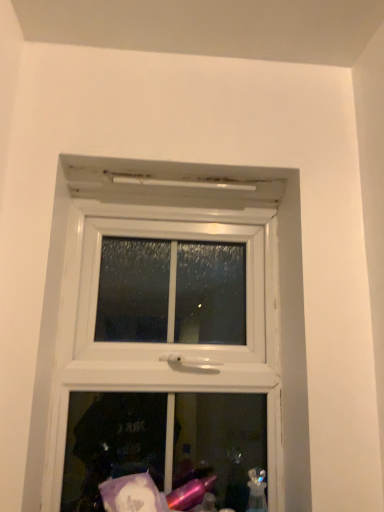
What do you see at coordinates (164, 223) in the screenshot? I see `white plastic window at center` at bounding box center [164, 223].

The height and width of the screenshot is (512, 384). What are the coordinates of `white plastic window at center` in the screenshot? It's located at (164, 223).

Locate an element on the screen. The image size is (384, 512). white plastic window at center is located at coordinates 164,223.